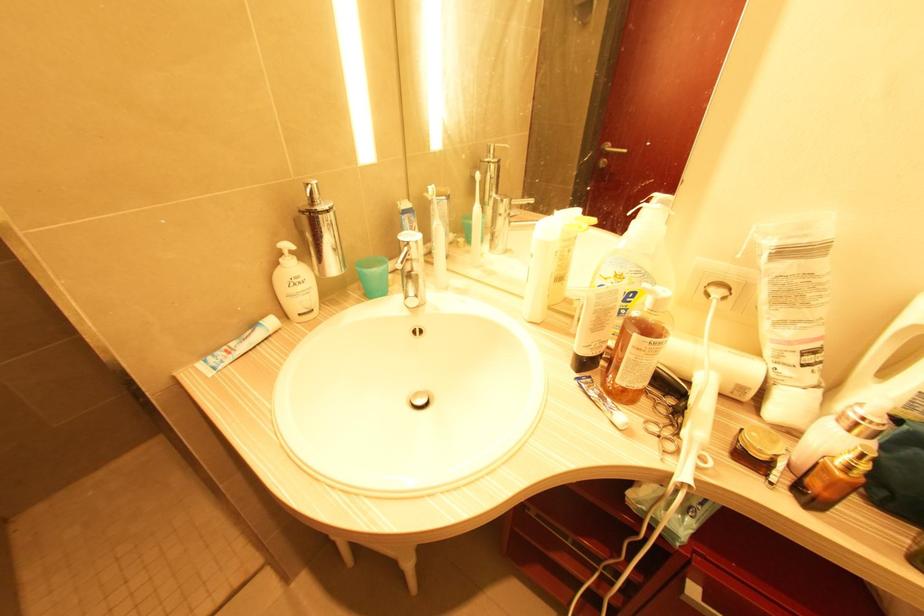
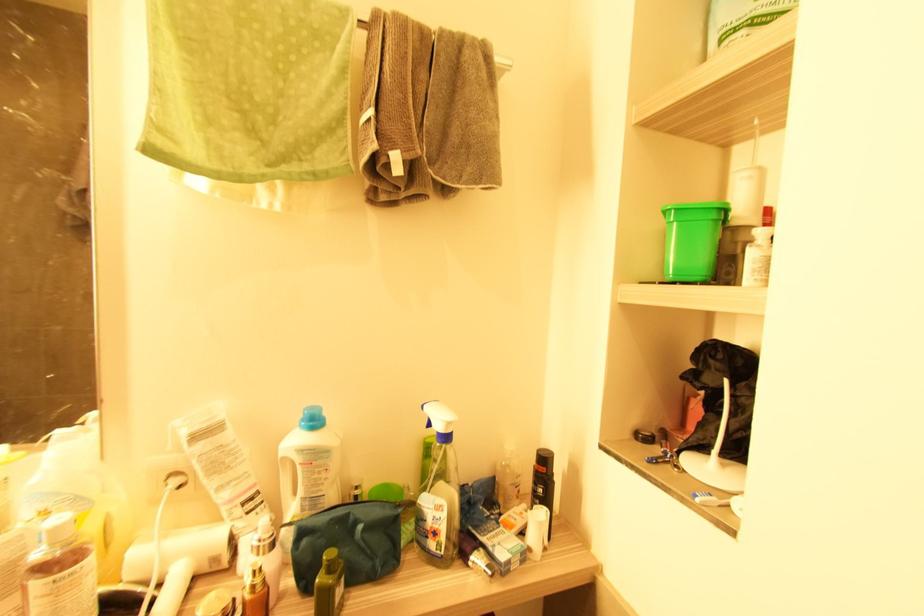
The point at (743, 390) is marked in the first image. Where is the corresponding point in the second image?

(216, 561)